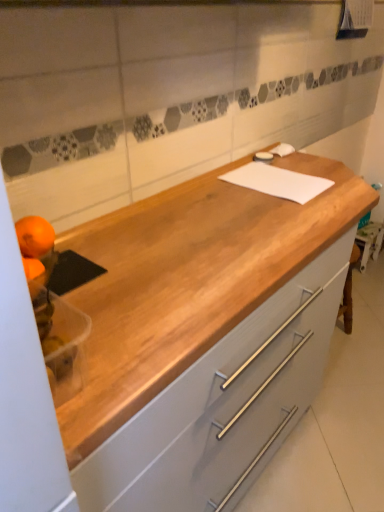
Image resolution: width=384 pixels, height=512 pixels. I want to click on vacant space in between white matte cutting board at center and orangesmoothfruit at left, which is the first orange from top to bottom, so click(198, 219).